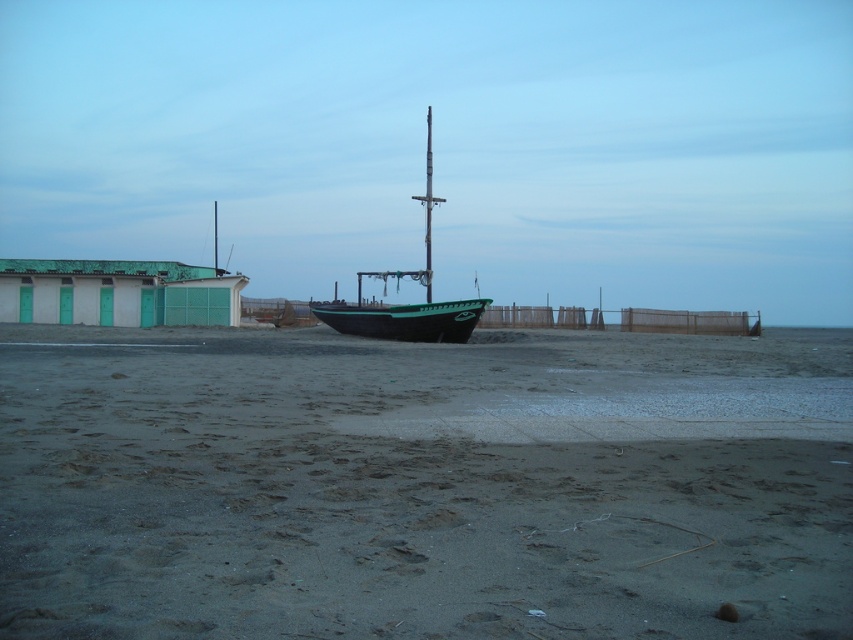
Question: Is gray sand at center to the right of green matte boat at center from the viewer's perspective?

Choices:
 (A) no
 (B) yes

Answer: (B)

Question: Among these points, which one is nearest to the camera?

Choices:
 (A) (431, 324)
 (B) (332, 442)

Answer: (B)

Question: Which of the following is the farthest from the observer?

Choices:
 (A) (424, 317)
 (B) (822, 632)

Answer: (A)

Question: From the image, what is the correct spatial relationship of gray sand at center in relation to green matte boat at center?

Choices:
 (A) below
 (B) above

Answer: (A)

Question: Is gray sand at center below green matte boat at center?

Choices:
 (A) no
 (B) yes

Answer: (B)